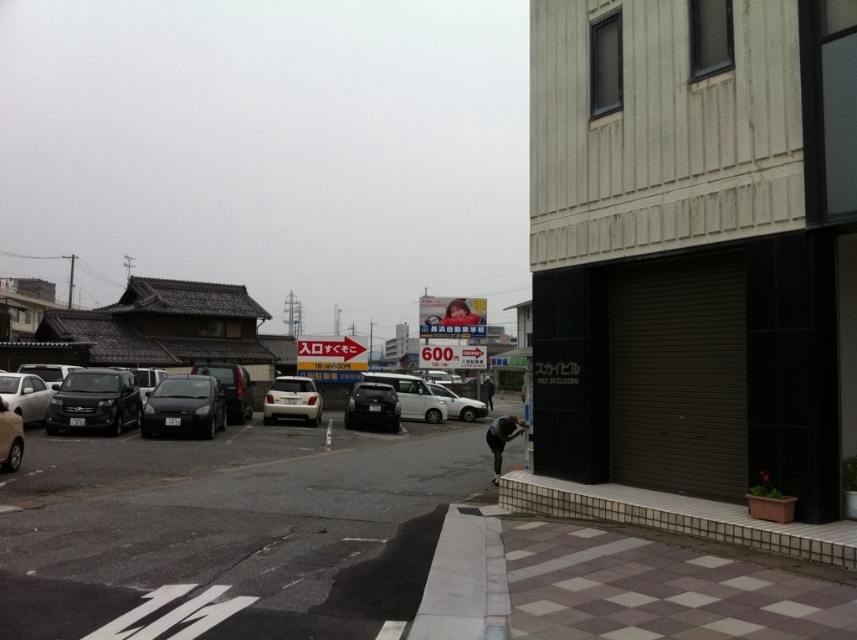
From the picture: You are a delivery person trying to park your vehicle in the parking area on the left side of the street. You need to know which vehicle is closer to the curb to determine where to park. Which vehicle is positioned lower relative to the curb between the matte black suv at left and the matte silver car at left?

The matte black suv at left is positioned lower relative to the curb than the matte silver car at left, so it is closer to the curb.

You are a delivery person trying to park your 1.8 meters wide van between the matte silver car at left and the white matte car at center. Can you fit your van there?

The matte silver car at left has a lesser width compared to white matte car at center. This means the space between them may be narrower than the van. However, without knowing the exact distance between the cars, it is impossible to determine if the van will fit. Please check the actual space available.

You are standing at the point marked as point (94, 401) in the image. What object are you facing?

You are facing the matte black suv at left.